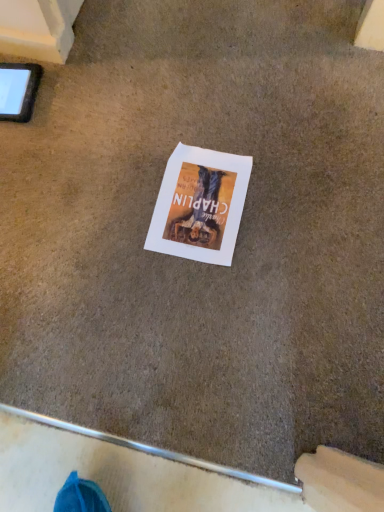
Where is `vacant space underneath white paper at center (from a real-world perspective)`? vacant space underneath white paper at center (from a real-world perspective) is located at coordinates (195, 207).